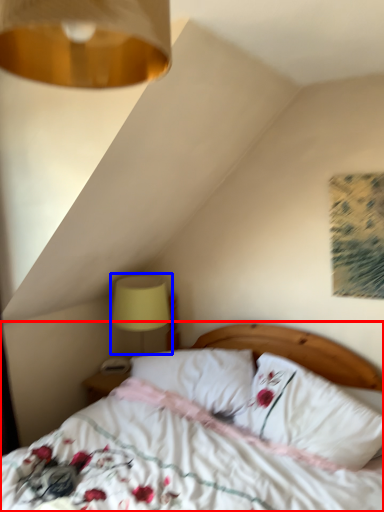
Question: Which of the following is the closest to the observer, bed (highlighted by a red box) or table lamp (highlighted by a blue box)?

Choices:
 (A) bed
 (B) table lamp

Answer: (A)